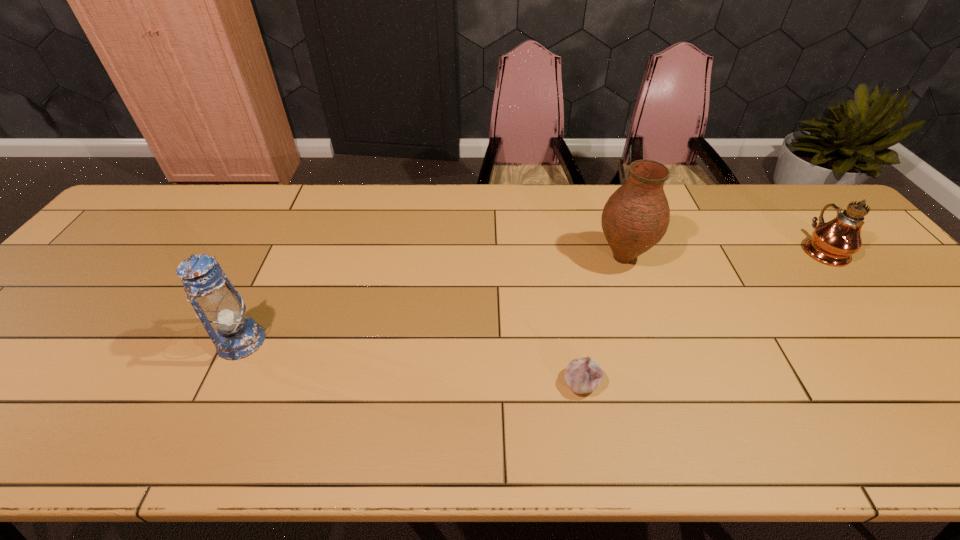
This screenshot has height=540, width=960. Find the location of `vacant space that's between the vase and the lantern`. vacant space that's between the vase and the lantern is located at coordinates (432, 299).

Locate an element on the screen. vacant region between the third object from left to right and the third farthest object is located at coordinates (432, 299).

Where is `unoccupied position between the oil lamp and the second nearest object`? unoccupied position between the oil lamp and the second nearest object is located at coordinates (532, 295).

Locate an element on the screen. This screenshot has width=960, height=540. unoccupied position between the garlic and the leftmost object is located at coordinates (411, 361).

The width and height of the screenshot is (960, 540). Find the location of `unoccupied position between the second nearest object and the second object from left to right`. unoccupied position between the second nearest object and the second object from left to right is located at coordinates (411, 361).

Identify which object is the second closest to the rightmost object. Please provide its 2D coordinates. Your answer should be formatted as a tuple, i.e. [(x, y)], where the tuple contains the x and y coordinates of a point satisfying the conditions above.

[(583, 375)]

Point out which object is positioned as the nearest to the second object from right to left. Please provide its 2D coordinates. Your answer should be formatted as a tuple, i.e. [(x, y)], where the tuple contains the x and y coordinates of a point satisfying the conditions above.

[(583, 375)]

Identify the location of vacant space that satisfies the following two spatial constraints: 1. on the front-facing side of the nearest object; 2. on the left side of the lantern. (222, 382).

In order to click on blank area in the image that satisfies the following two spatial constraints: 1. on the back side of the third object from right to left; 2. on the front-facing side of the lantern in this screenshot , I will do `click(574, 341)`.

You are a GUI agent. You are given a task and a screenshot of the screen. Output one action in this format:
    pyautogui.click(x=<x>, y=<y>)
    Task: Click on the vacant space that satisfies the following two spatial constraints: 1. on the front side of the third object from left to right; 2. on the front-facing side of the lantern
    
    Given the screenshot: What is the action you would take?
    pyautogui.click(x=652, y=341)